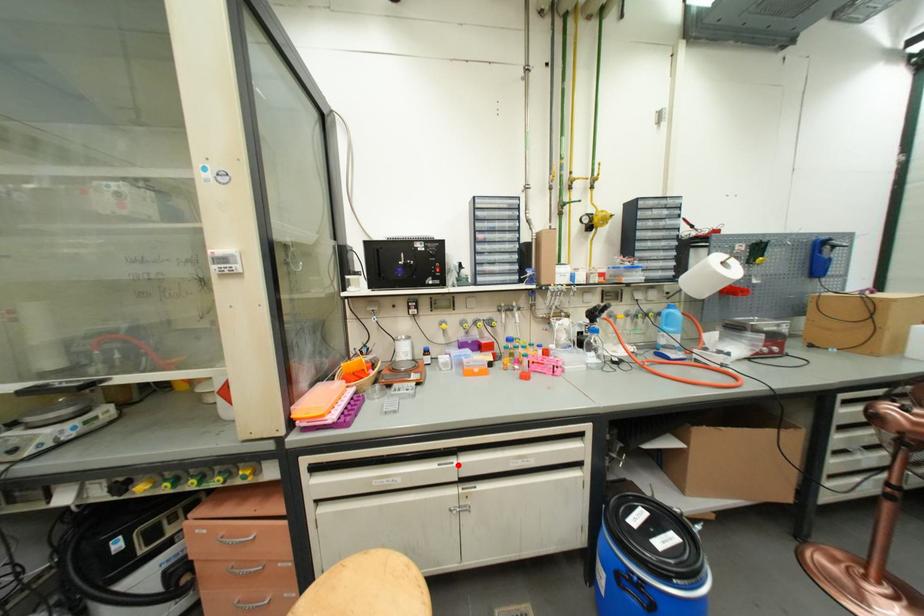
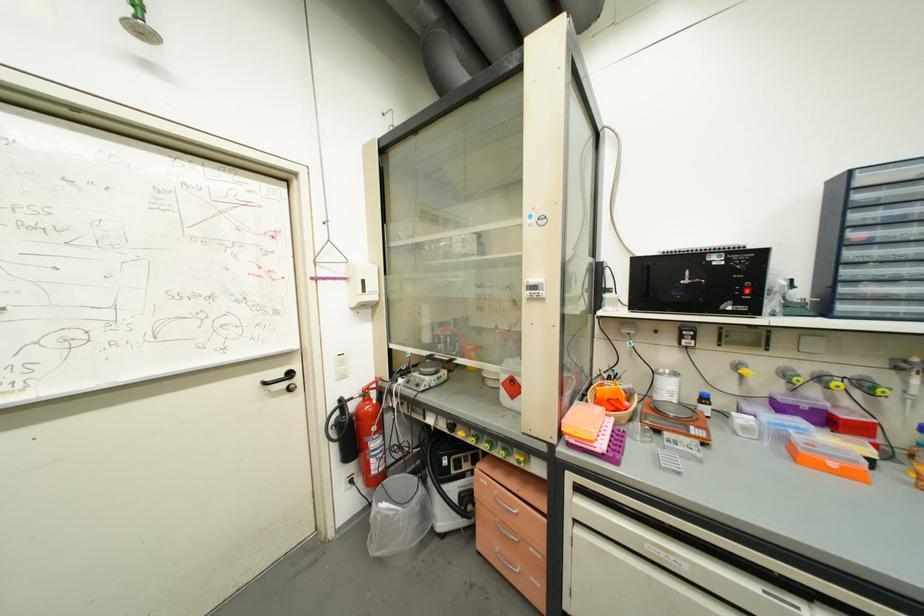
Find the pixel in the second image that matches the highlighted location in the first image.

(803, 610)